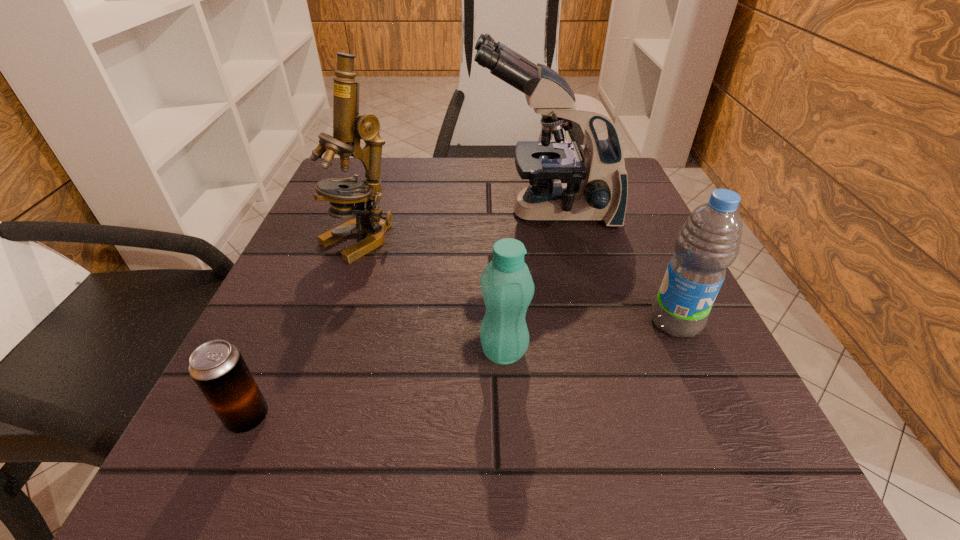
The image size is (960, 540). In order to click on empty space that is in between the right microscope and the shortest object in this screenshot , I will do `click(397, 315)`.

This screenshot has height=540, width=960. Identify the location of blank region between the nearest object and the bottle. (376, 384).

Where is `free space between the shortest object and the left microscope`? Image resolution: width=960 pixels, height=540 pixels. free space between the shortest object and the left microscope is located at coordinates (303, 329).

Find the location of `object that is the second closest one to the left microscope`. object that is the second closest one to the left microscope is located at coordinates (507, 287).

Locate an element on the screen. The height and width of the screenshot is (540, 960). object identified as the third closest to the water bottle is located at coordinates (349, 127).

Identify the location of vacant area in the image that satisfies the following two spatial constraints: 1. through the eyepieces of the right microscope; 2. on the front side of the shortest object. (588, 417).

I want to click on blank space that satisfies the following two spatial constraints: 1. on the back side of the water bottle; 2. on the left side of the shortest object, so click(x=291, y=322).

This screenshot has width=960, height=540. Find the location of `free spot that satisfies the following two spatial constraints: 1. on the back side of the shortest object; 2. on the right side of the third shortest object`. free spot that satisfies the following two spatial constraints: 1. on the back side of the shortest object; 2. on the right side of the third shortest object is located at coordinates (291, 322).